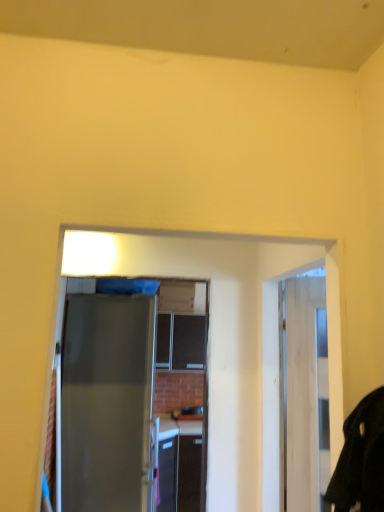
Question: Is satin gray door at center to the left or to the right of black matte robe at right in the image?

Choices:
 (A) right
 (B) left

Answer: (B)

Question: Would you say satin gray door at center is inside or outside black matte robe at right?

Choices:
 (A) inside
 (B) outside

Answer: (B)

Question: In the image, is satin gray door at center positioned in front of or behind black matte robe at right?

Choices:
 (A) behind
 (B) front

Answer: (A)

Question: Does point (374, 396) appear closer or farther from the camera than point (72, 378)?

Choices:
 (A) closer
 (B) farther

Answer: (A)

Question: From a real-world perspective, is black matte robe at right positioned above or below satin gray door at center?

Choices:
 (A) above
 (B) below

Answer: (A)

Question: Considering their positions, is black matte robe at right located in front of or behind satin gray door at center?

Choices:
 (A) front
 (B) behind

Answer: (A)

Question: Based on their sizes in the image, would you say black matte robe at right is bigger or smaller than satin gray door at center?

Choices:
 (A) big
 (B) small

Answer: (B)